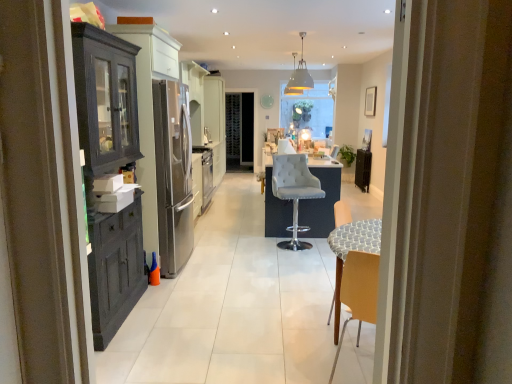
What do you see at coordinates (109, 173) in the screenshot?
I see `matte dark wood cabinet at left` at bounding box center [109, 173].

Locate an element on the screen. The width and height of the screenshot is (512, 384). matte dark wood cabinet at left is located at coordinates point(109,173).

Find the location of a particular element. gray fabric bar stool at center is located at coordinates (294, 191).

I want to click on matte dark wood cabinet at left, so click(x=109, y=173).

Based on the photo, from a real-world perspective, which is physically above, black metallic radiator at right or matte dark wood cabinet at left?

matte dark wood cabinet at left is physically above.

Is black metallic radiator at right bigger or smaller than matte dark wood cabinet at left?

Considering their sizes, black metallic radiator at right takes up less space than matte dark wood cabinet at left.

Is black metallic radiator at right to the right of matte dark wood cabinet at left from the viewer's perspective?

Correct, you'll find black metallic radiator at right to the right of matte dark wood cabinet at left.

Is black metallic radiator at right located outside matte dark wood cabinet at left?

Yes.

From a real-world perspective, is metallic pendant light at upper center under matte dark wood cabinet at left?

No, from a real-world perspective, metallic pendant light at upper center is not beneath matte dark wood cabinet at left.

Which is correct: metallic pendant light at upper center is inside matte dark wood cabinet at left, or outside of it?

metallic pendant light at upper center lies outside matte dark wood cabinet at left.

Is point (289, 92) farther from viewer compared to point (95, 239)?

Yes, point (289, 92) is behind point (95, 239).

Identify the location of light fixture that is on the right side of matte dark wood cabinet at left. (298, 76).

Which of these two, gray fabric bar stool at center or black metallic radiator at right, is smaller?

With smaller size is black metallic radiator at right.

How many degrees apart are the facing directions of gray fabric bar stool at center and black metallic radiator at right?

105 degrees.

Is gray fabric bar stool at center with black metallic radiator at right?

No, gray fabric bar stool at center is not beside black metallic radiator at right.

From the picture: Is gray fabric bar stool at center wider or thinner than black metallic radiator at right?

Clearly, gray fabric bar stool at center has more width compared to black metallic radiator at right.

Is matte dark wood cabinet at left completely or partially outside of black metallic radiator at right?

matte dark wood cabinet at left is positioned outside black metallic radiator at right.

Identify the location of appliance that appears on the right of matte dark wood cabinet at left. (362, 169).

Considering the relative positions of matte dark wood cabinet at left and black metallic radiator at right in the image provided, is matte dark wood cabinet at left to the left of black metallic radiator at right from the viewer's perspective?

Indeed, matte dark wood cabinet at left is positioned on the left side of black metallic radiator at right.

Which object is wider, matte dark wood cabinet at left or black metallic radiator at right?

With larger width is matte dark wood cabinet at left.

What's the angular difference between gray fabric bar stool at center and metallic pendant light at upper center's facing directions?

13 degrees separate the facing orientations of gray fabric bar stool at center and metallic pendant light at upper center.

Looking at this image, from a real-world perspective, which is physically above, gray fabric bar stool at center or metallic pendant light at upper center?

metallic pendant light at upper center, from a real-world perspective.

Is gray fabric bar stool at center turned away from metallic pendant light at upper center?

That's not correct — gray fabric bar stool at center is not looking away from metallic pendant light at upper center.

Which point is more distant from viewer, (289,156) or (294,74)?

The point (294,74) is behind.

What are the coordinates of `light fixture on the right of gray fabric bar stool at center` in the screenshot? It's located at (298, 76).

Does metallic pendant light at upper center turn towards gray fabric bar stool at center?

No, metallic pendant light at upper center does not turn towards gray fabric bar stool at center.

Based on the photo, is metallic pendant light at upper center far from gray fabric bar stool at center?

Absolutely, metallic pendant light at upper center is distant from gray fabric bar stool at center.

Is metallic pendant light at upper center surrounding gray fabric bar stool at center?

Definitely not — gray fabric bar stool at center is not inside metallic pendant light at upper center.

Considering the points (94, 234) and (278, 167), which point is behind, point (94, 234) or point (278, 167)?

The point (278, 167) is more distant.

Is matte dark wood cabinet at left placed right next to gray fabric bar stool at center?

No, matte dark wood cabinet at left is not with gray fabric bar stool at center.

Is matte dark wood cabinet at left bigger than gray fabric bar stool at center?

Yes.

In order to click on cabinetry located above the black metallic radiator at right (from a real-world perspective) in this screenshot , I will do `click(109, 173)`.

Where is `light fixture behind the matte dark wood cabinet at left`? This screenshot has width=512, height=384. light fixture behind the matte dark wood cabinet at left is located at coordinates (298, 76).

From the image, which object appears to be nearer to gray fabric bar stool at center, black metallic radiator at right or metallic pendant light at upper center?

black metallic radiator at right is positioned closer to the anchor gray fabric bar stool at center.

Which object lies nearer to the anchor point metallic pendant light at upper center, black metallic radiator at right or gray fabric bar stool at center?

The object closer to metallic pendant light at upper center is black metallic radiator at right.

Which object lies nearer to the anchor point matte dark wood cabinet at left, metallic pendant light at upper center or black metallic radiator at right?

Among the two, black metallic radiator at right is located nearer to matte dark wood cabinet at left.

From the image, which object appears to be farther from metallic pendant light at upper center, matte dark wood cabinet at left or black metallic radiator at right?

matte dark wood cabinet at left is further to metallic pendant light at upper center.

When comparing their distances from matte dark wood cabinet at left, does gray fabric bar stool at center or metallic pendant light at upper center seem further?

Based on the image, metallic pendant light at upper center appears to be further to matte dark wood cabinet at left.

Based on their spatial positions, is matte dark wood cabinet at left or metallic pendant light at upper center further from black metallic radiator at right?

matte dark wood cabinet at left is further to black metallic radiator at right.

Considering their positions, is metallic pendant light at upper center positioned closer to gray fabric bar stool at center than matte dark wood cabinet at left?

The object closer to gray fabric bar stool at center is matte dark wood cabinet at left.

In the scene shown: Estimate the real-world distances between objects in this image. Which object is closer to gray fabric bar stool at center, metallic pendant light at upper center or black metallic radiator at right?

The object closer to gray fabric bar stool at center is black metallic radiator at right.

Identify the location of light fixture positioned between matte dark wood cabinet at left and black metallic radiator at right from near to far. (298, 76).

I want to click on light fixture between gray fabric bar stool at center and black metallic radiator at right from front to back, so click(x=298, y=76).

Locate an element on the screen. chair situated between matte dark wood cabinet at left and metallic pendant light at upper center from left to right is located at coordinates (294, 191).

Find the location of a particular element. The height and width of the screenshot is (384, 512). chair positioned between matte dark wood cabinet at left and black metallic radiator at right from near to far is located at coordinates point(294,191).